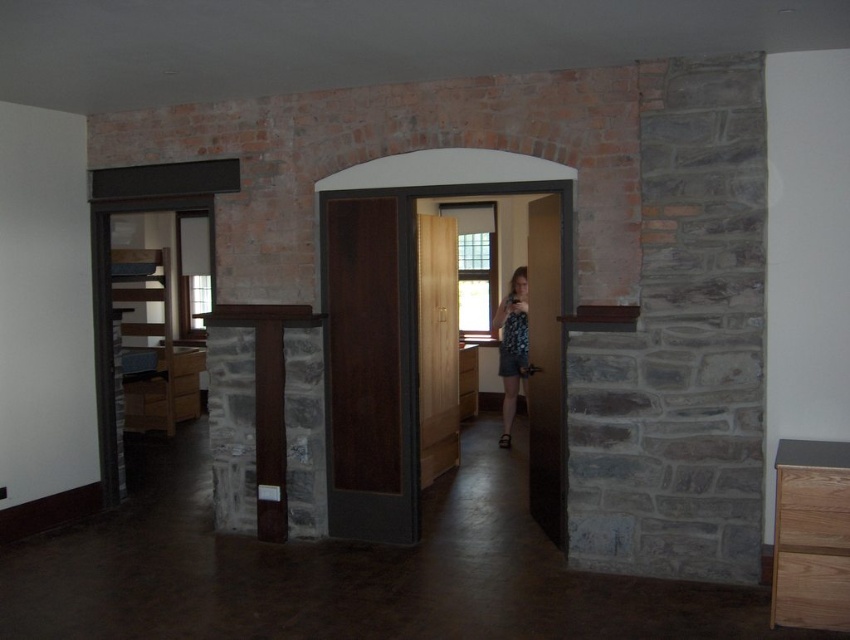
You are standing in the room and want to pick up the printed fabric dress at center. Which direction should you move relative to the wooden door at center?

The wooden door at center is above the printed fabric dress at center, so you should move downward towards the dress.

You are standing in the room and want to move from point [537,513] to point [503,426]. Considering the staircase visible to the left of the door, will you need to climb upwards or go downwards to reach the destination?

Since point [537,513] is closer to the viewer than point [503,426], you will need to go downwards to reach the destination as the latter is further away and likely on a lower level.